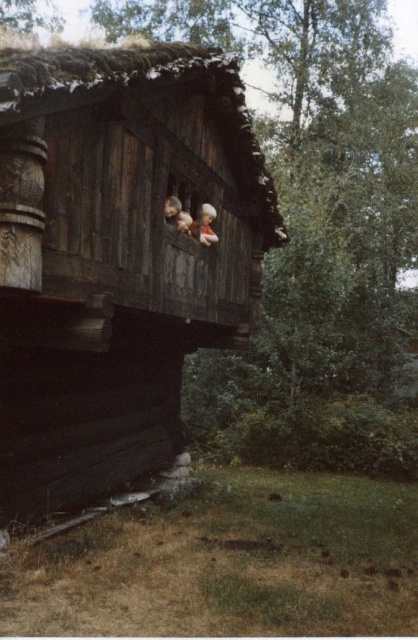
In the scene shown: Is the position of dark brown wooden log cabin at center less distant than that of smooth wooden doll at upper center?

That is True.

Is dark brown wooden log cabin at center wider than smooth wooden doll at upper center?

No, dark brown wooden log cabin at center is not wider than smooth wooden doll at upper center.

Which is in front, point (137, 136) or point (191, 227)?

Point (137, 136)

This screenshot has height=640, width=418. I want to click on dark brown wooden log cabin at center, so click(117, 257).